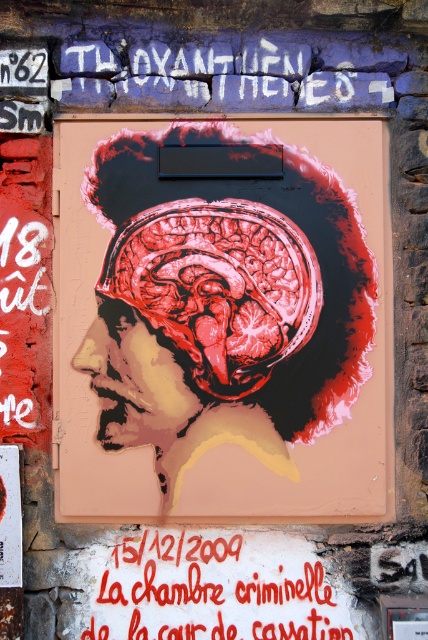
What is the anatomical structure depicted at the coordinates point (223, 320) in the street art?

The point (223, 320) indicates the matte black anatomical brain at center.

You are an art restorer examining the street art. You need to clean the matte black anatomical brain at center and the red painted text at center. Which object should you clean first if you want to start with the one closer to you?

You should clean the matte black anatomical brain at center first because it is closer to you than the red painted text at center according to the description.